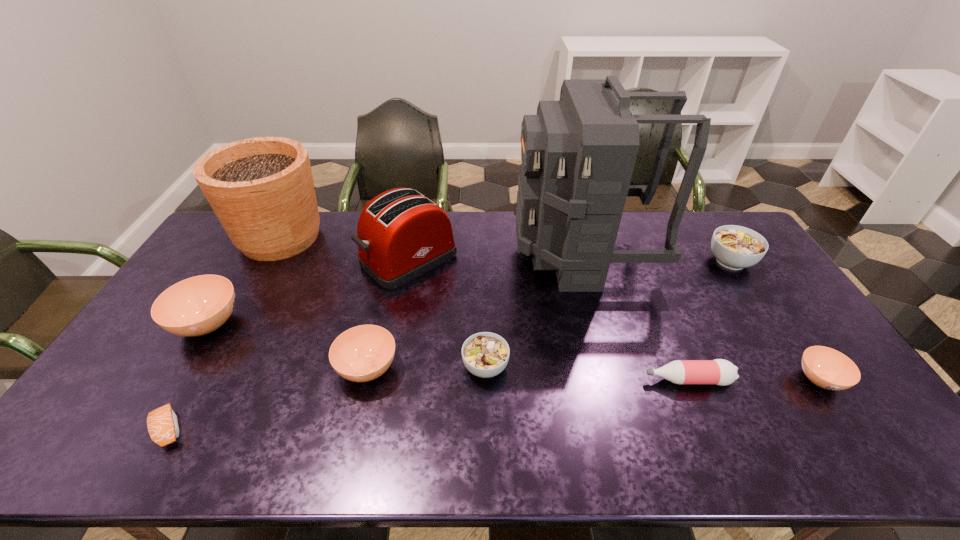
Where is `the fourth soup bowl from right to left`? Image resolution: width=960 pixels, height=540 pixels. the fourth soup bowl from right to left is located at coordinates (363, 353).

You are a GUI agent. You are given a task and a screenshot of the screen. Output one action in this format:
    pyautogui.click(x=<x>, y=<y>)
    Task: Click on the left white soup bowl
    This screenshot has height=540, width=960.
    Given the screenshot: What is the action you would take?
    pyautogui.click(x=485, y=354)

Where is `the third soup bowl from left to right`? the third soup bowl from left to right is located at coordinates (485, 354).

I want to click on bottle, so click(x=721, y=372).

Find the location of `the smallest peach soup bowl`. the smallest peach soup bowl is located at coordinates (827, 368).

You are a GUI agent. You are given a task and a screenshot of the screen. Output one action in this format:
    pyautogui.click(x=<x>, y=<y>)
    Task: Click on the rightmost peach soup bowl
    The height and width of the screenshot is (540, 960).
    Given the screenshot: What is the action you would take?
    pyautogui.click(x=827, y=368)

What are the coordinates of `the nearest object` in the screenshot? It's located at coord(162,423).

Where is `orange sushi`? The image size is (960, 540). orange sushi is located at coordinates (162, 423).

This screenshot has width=960, height=540. Identify the location of vacant region located on the front compartment of the gray backpack. (489, 252).

Identify the location of vacant area located 0.250m on the front compartment of the gray backpack. (444, 252).